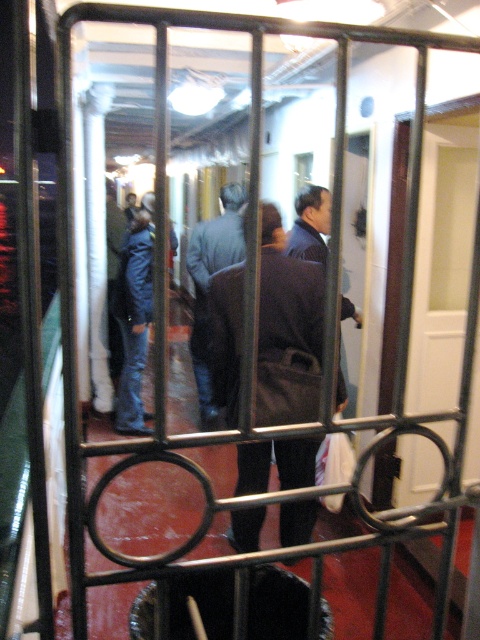
You are a photographer standing outside the metal gate. You want to take a clear photo of the dark brown leather coat at center inside the hallway. Considering the gate is slightly obscuring the view, can you estimate if the coat is within the camera focus range of 8 feet?

The dark brown leather coat at center is 7.79 feet away from the camera, which is within the 8 feet focus range. Therefore, the coat should be in focus.

In the scene shown: You are a photographer positioned outside the metal gate. You want to take a photo of the dark brown leather coat at center and the dark gray suit at center through the gate. Which object will appear closer to the camera in the photo?

The dark brown leather coat at center will appear closer to the camera because it is shorter than the dark gray suit at center, so it is positioned closer to the gate.